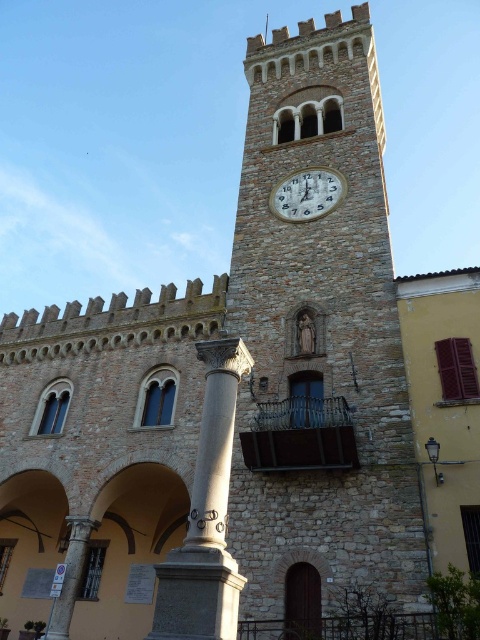
You are an architect examining the historic stone building. You notice the smooth stone column at center and the white glossy clock at center. Which object is located to the left of the other?

The smooth stone column at center is positioned on the left side of white glossy clock at center.

You are an architect inspecting the building. You notice the smooth stone column at center and the white glossy clock at center. Which object is located below the other?

The smooth stone column at center is positioned under the white glossy clock at center, so the column is below the clock.

You are an architect designing a new building inspired by the historic stone building. You need to ensure that the smooth stone column at center and the white glossy clock at center maintain a proportional relationship. Based on the original image, which object should have a larger diameter to preserve the architectural harmony?

The smooth stone column at center should be wider than the white glossy clock at center to preserve the architectural harmony.